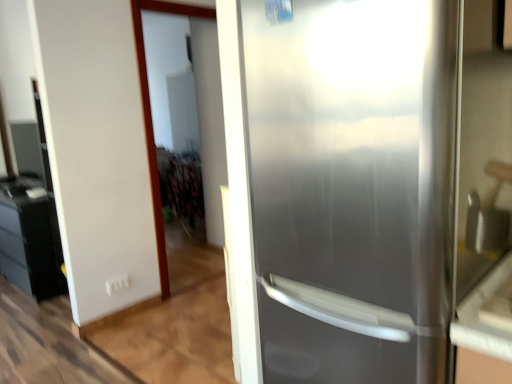
Where is `satin white screen door at upper left`? This screenshot has height=384, width=512. satin white screen door at upper left is located at coordinates (151, 113).

Locate an element on the screen. This screenshot has height=384, width=512. matte black cabinet at left is located at coordinates (30, 239).

Image resolution: width=512 pixels, height=384 pixels. I want to click on screen door above the satin silver refrigerator at right (from a real-world perspective), so click(x=151, y=113).

Are satin white screen door at upper left and satin silver refrigerator at right far apart?

Yes, satin white screen door at upper left and satin silver refrigerator at right are located far from each other.

From a real-world perspective, who is located lower, satin white screen door at upper left or satin silver refrigerator at right?

satin silver refrigerator at right is physically lower.

Is satin white screen door at upper left facing away from satin silver refrigerator at right?

No.

Which is behind, point (440, 64) or point (204, 12)?

The point (204, 12) is more distant.

Considering the sizes of satin silver refrigerator at right and satin white screen door at upper left in the image, is satin silver refrigerator at right bigger or smaller than satin white screen door at upper left?

satin silver refrigerator at right is bigger than satin white screen door at upper left.

Considering the positions of objects satin silver refrigerator at right and satin white screen door at upper left in the image provided, who is behind, satin silver refrigerator at right or satin white screen door at upper left?

satin white screen door at upper left is more distant.

Is satin silver refrigerator at right oriented towards satin white screen door at upper left?

No, satin silver refrigerator at right does not turn towards satin white screen door at upper left.

Looking at this image, considering the positions of objects satin white screen door at upper left and matte black cabinet at left in the image provided, who is more to the right, satin white screen door at upper left or matte black cabinet at left?

Positioned to the right is satin white screen door at upper left.

Looking at this image, is satin white screen door at upper left smaller than matte black cabinet at left?

Indeed, satin white screen door at upper left has a smaller size compared to matte black cabinet at left.

From the image's perspective, is satin white screen door at upper left on matte black cabinet at left?

Correct, satin white screen door at upper left appears higher than matte black cabinet at left in the image.

Is satin white screen door at upper left not close to matte black cabinet at left?

Yes.

Is matte black cabinet at left oriented away from satin white screen door at upper left?

That's not correct — matte black cabinet at left is not looking away from satin white screen door at upper left.

Is matte black cabinet at left surrounding satin white screen door at upper left?

Definitely not — satin white screen door at upper left is not inside matte black cabinet at left.

Is matte black cabinet at left smaller than satin white screen door at upper left?

Actually, matte black cabinet at left might be larger than satin white screen door at upper left.

Which of these two, matte black cabinet at left or satin white screen door at upper left, is thinner?

satin white screen door at upper left is thinner.

Is matte black cabinet at left next to satin silver refrigerator at right?

matte black cabinet at left and satin silver refrigerator at right are not in contact.

At what (x,y) coordinates should I click in order to perform the action: click on cabinetry that is on the left side of satin silver refrigerator at right. Please return your answer as a coordinate pair (x, y). The width and height of the screenshot is (512, 384). Looking at the image, I should click on (30, 239).

From a real-world perspective, who is located higher, matte black cabinet at left or satin silver refrigerator at right?

From a 3D spatial view, satin silver refrigerator at right is above.

Is matte black cabinet at left looking in the opposite direction of satin silver refrigerator at right?

No.

Is satin silver refrigerator at right not near matte black cabinet at left?

satin silver refrigerator at right is positioned a significant distance from matte black cabinet at left.

Considering the relative sizes of satin silver refrigerator at right and matte black cabinet at left in the image provided, is satin silver refrigerator at right shorter than matte black cabinet at left?

No, satin silver refrigerator at right is not shorter than matte black cabinet at left.

Which object is closer to the camera taking this photo, satin silver refrigerator at right or matte black cabinet at left?

satin silver refrigerator at right is more forward.

Which is farther, [405,108] or [4,201]?

Point [4,201]

Find the location of `screen door above the satin silver refrigerator at right (from a real-world perspective)`. screen door above the satin silver refrigerator at right (from a real-world perspective) is located at coordinates (151, 113).

The width and height of the screenshot is (512, 384). I want to click on refrigerator that appears below the satin white screen door at upper left (from the image's perspective), so click(x=343, y=186).

Based on the photo, when comparing their distances from matte black cabinet at left, does satin white screen door at upper left or satin silver refrigerator at right seem closer?

Based on the image, satin white screen door at upper left appears to be nearer to matte black cabinet at left.

Which object lies further to the anchor point satin white screen door at upper left, matte black cabinet at left or satin silver refrigerator at right?

satin silver refrigerator at right lies further to satin white screen door at upper left than the other object.

When comparing their distances from satin silver refrigerator at right, does matte black cabinet at left or satin white screen door at upper left seem further?

Among the two, matte black cabinet at left is located further to satin silver refrigerator at right.

Considering their positions, is satin silver refrigerator at right positioned further to matte black cabinet at left than satin white screen door at upper left?

Based on the image, satin silver refrigerator at right appears to be further to matte black cabinet at left.

Considering their positions, is satin silver refrigerator at right positioned closer to satin white screen door at upper left than matte black cabinet at left?

The object closer to satin white screen door at upper left is matte black cabinet at left.

Which object lies further to the anchor point satin silver refrigerator at right, satin white screen door at upper left or matte black cabinet at left?

Based on the image, matte black cabinet at left appears to be further to satin silver refrigerator at right.

Where is `screen door between matte black cabinet at left and satin silver refrigerator at right from left to right`? This screenshot has height=384, width=512. screen door between matte black cabinet at left and satin silver refrigerator at right from left to right is located at coordinates click(x=151, y=113).